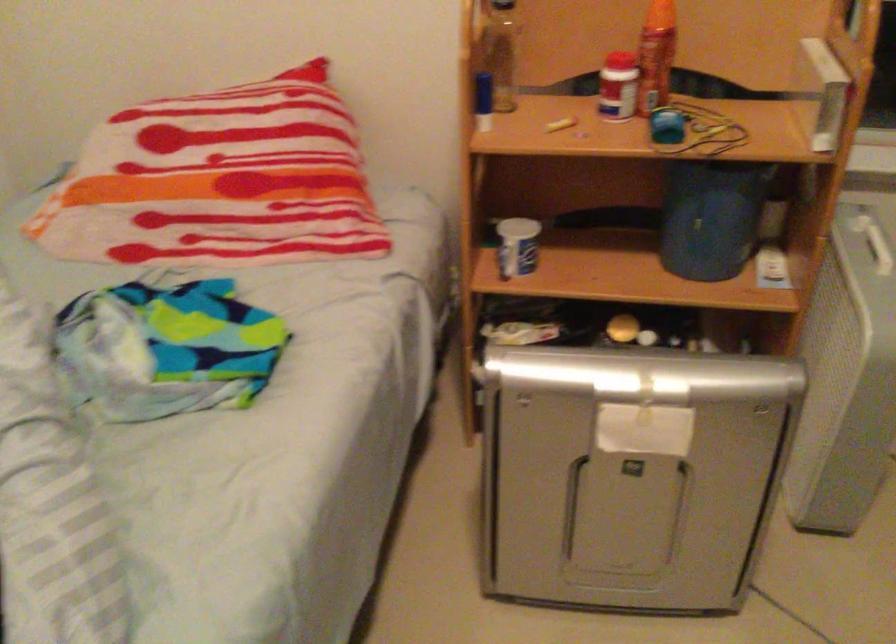
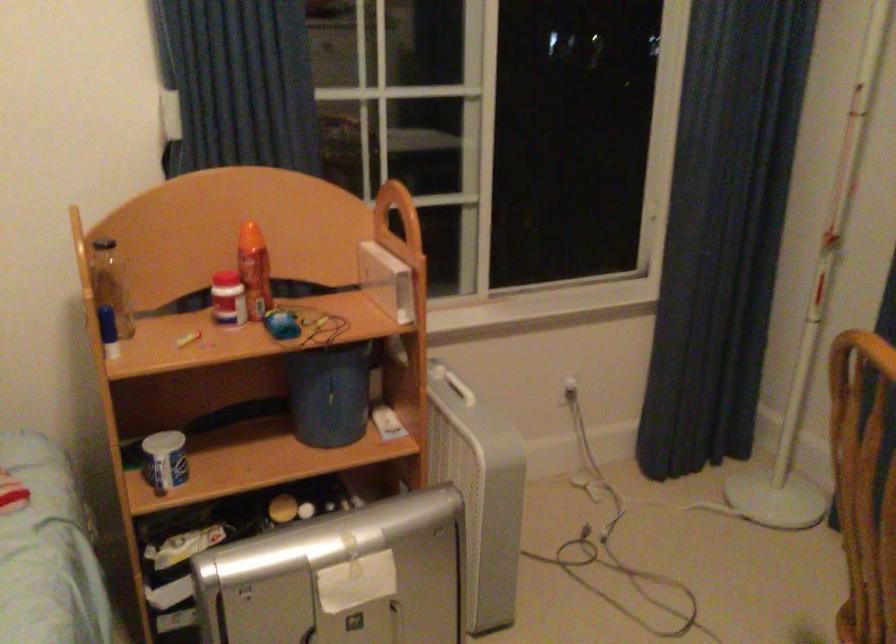
Locate, in the second image, the point that corresponds to (x=659, y=122) in the first image.

(281, 324)